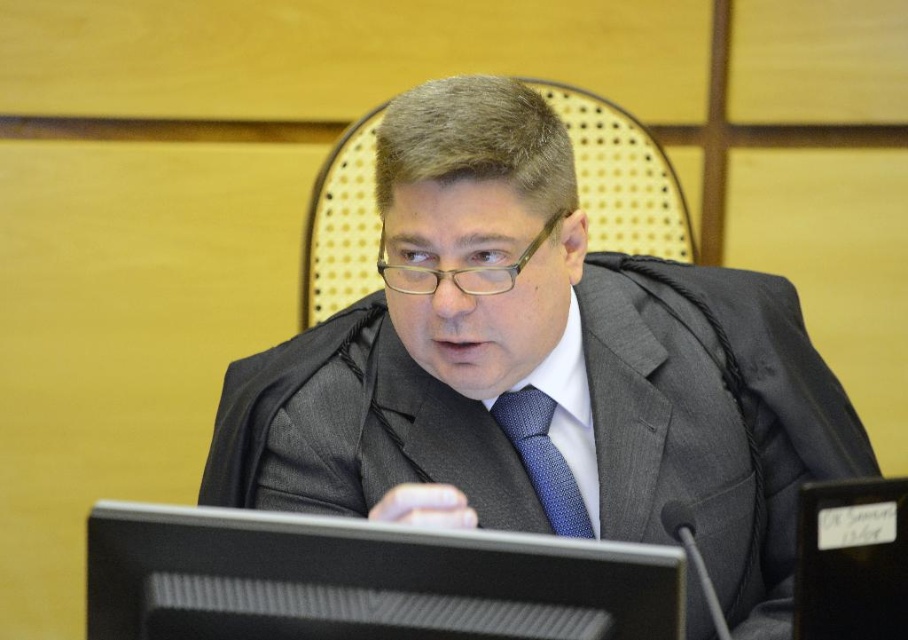
Consider the image. You are standing in the courtroom and need to reach the point marked at coordinates point (363,560). If your arm can extend 70 centimeters, can you reach that point without moving your feet?

The distance between you and the point (363,560) is 74.43 centimeters, which is slightly longer than your arm extension of 70 centimeters. Therefore, you cannot reach the point without moving your feet.

You are an observer in the courtroom. You notice the gray suit at center and the blue dotted fabric tie at center. Which object is located to the right side of the other?

The gray suit at center is positioned on the right side of blue dotted fabric tie at center.

Consider the image. You are an observer in the courtroom. You notice the gray suit at center and the blue dotted fabric tie at center. Which object is positioned closer to you?

The gray suit at center is closer to the viewer than the blue dotted fabric tie at center.